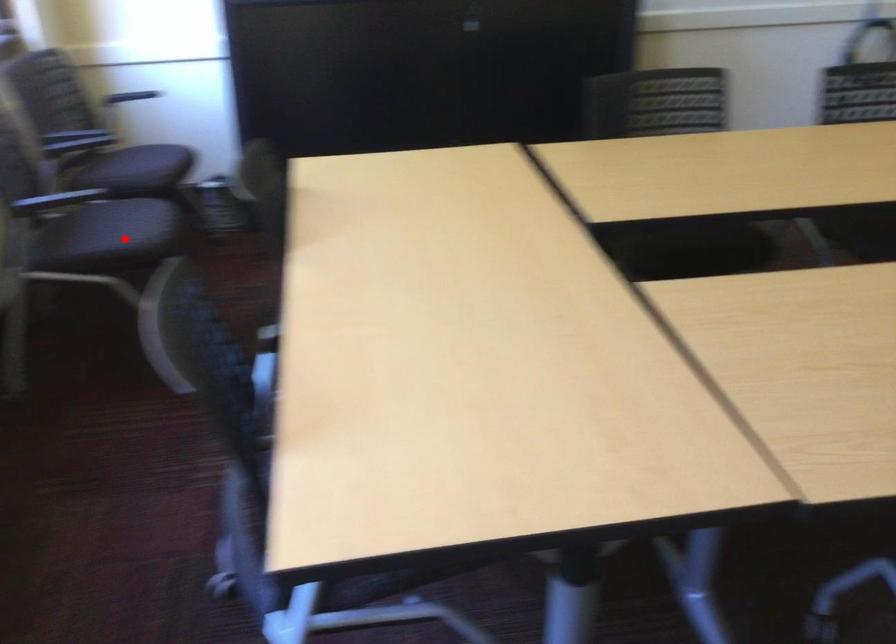
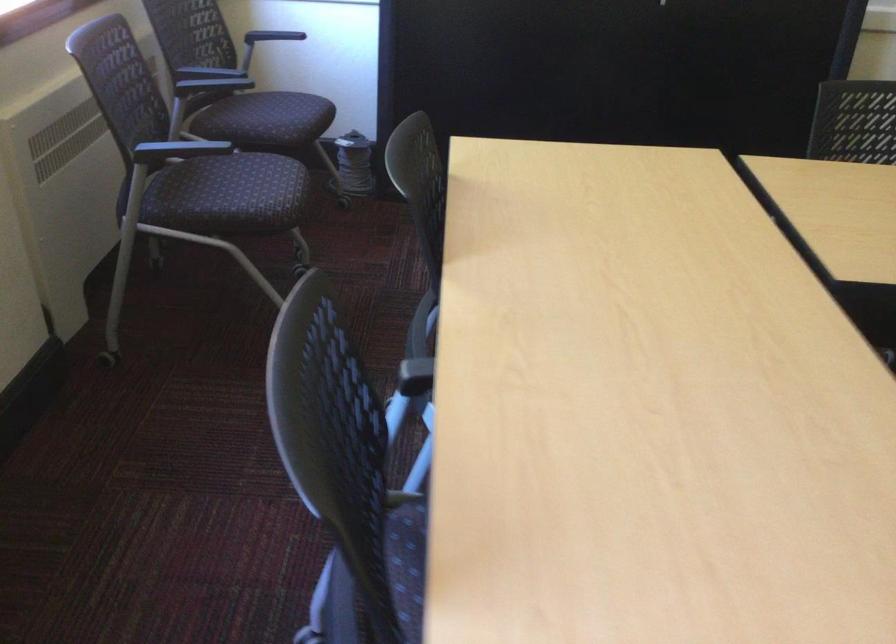
Question: I am providing you with two images of the same scene from different viewpoints. In image1, a red point is highlighted. Considering the same 3D point in image2, which of the following is correct?

Choices:
 (A) It is closer
 (B) It is farther

Answer: (A)